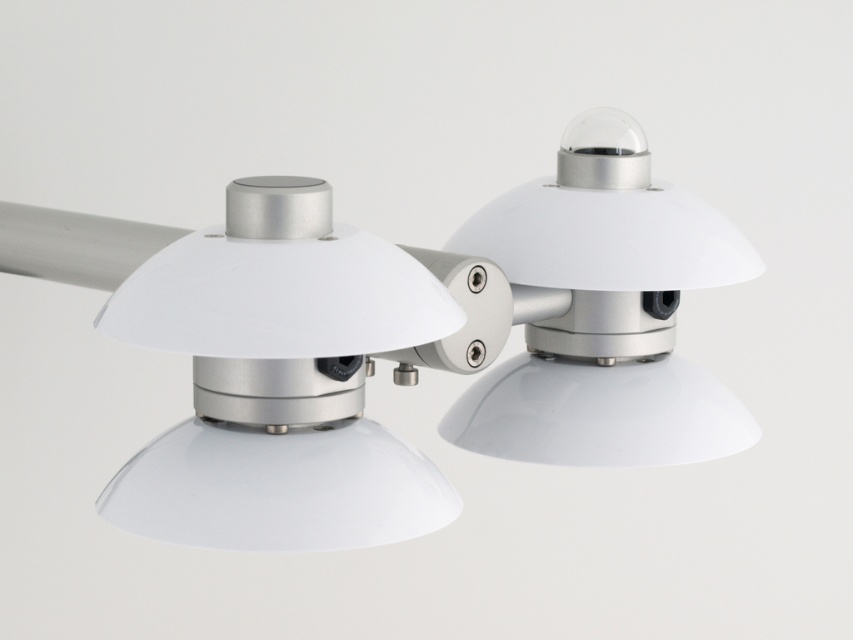
Question: Does white matte lampshade at center have a greater width compared to white glossy dome at upper right?

Choices:
 (A) yes
 (B) no

Answer: (A)

Question: Is white matte lampshade at center behind white glossy dome at upper right?

Choices:
 (A) yes
 (B) no

Answer: (B)

Question: Does white matte lampshade at center have a larger size compared to white glossy dome at upper right?

Choices:
 (A) yes
 (B) no

Answer: (A)